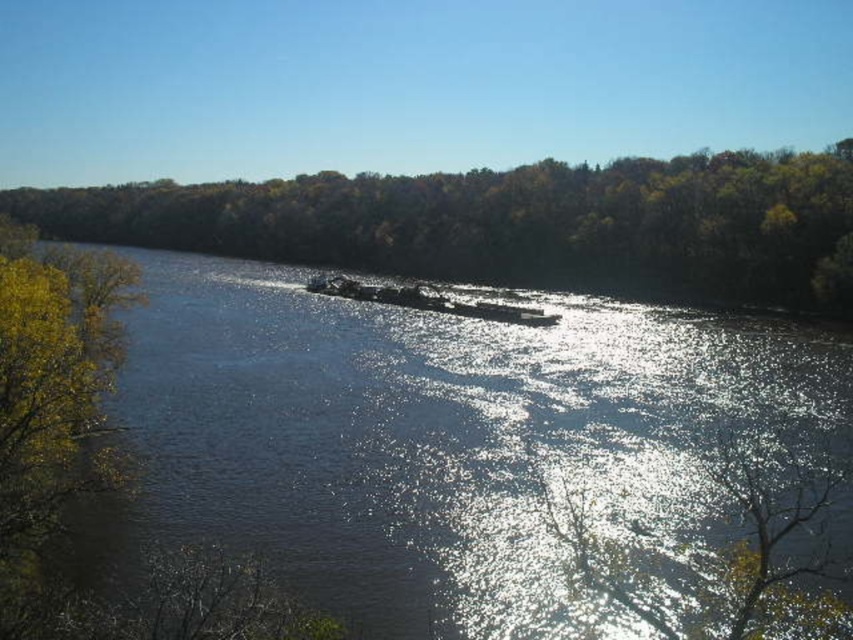
You are standing on the riverbank and see the dark blue water at center and the metallic gray barge at center. Which object is closer to the ground level?

The dark blue water at center is located below the metallic gray barge at center, so it is closer to the ground level.

You are an observer standing on the riverbank looking at the scene. Which object, the green leafy trees at center or the metallic gray barge at center, takes up more space in the image?

The green leafy trees at center takes up more space in the image than the metallic gray barge at center because it is bigger.